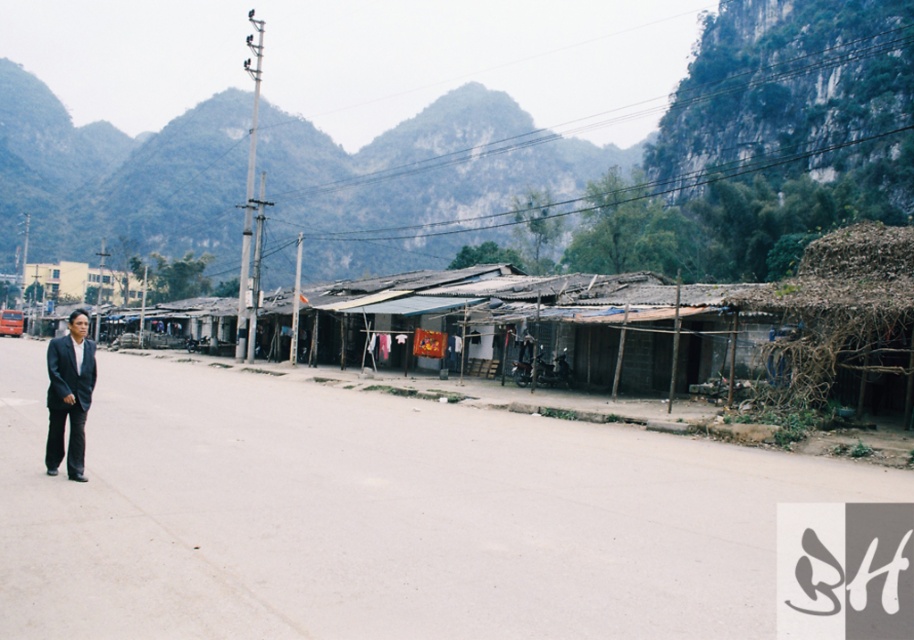
You are standing on the paved road in the rural scene. You see the green rocky mountain at upper center and the matte black suit at left. Which object is higher in elevation?

The green rocky mountain at upper center is taller than the matte black suit at left, so the green rocky mountain at upper center is higher in elevation.